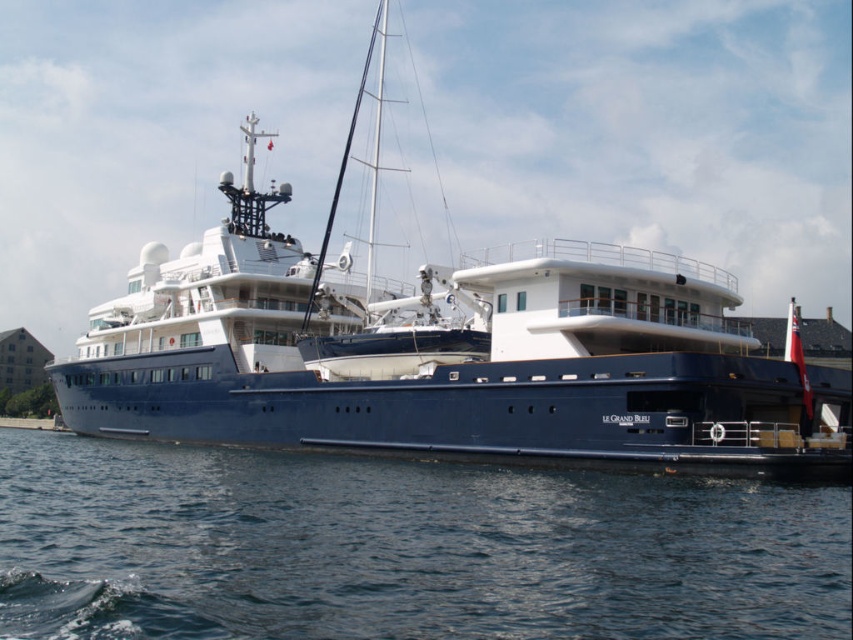
You are a marine engineer assessing the docking space for the blue polished yacht at center. The marina has a docking bay that is 60 meters long. Can the yacht fit into the bay? Please explain your reasoning.

The blue polished yacht at center is 61.26 meters in length, which exceeds the 60 meters available in the docking bay. Therefore, the yacht cannot fit into the bay.

Based on the photo, you are a photographer planning to take a photo of the blue polished yacht at center and the blue water at lower center. Considering their sizes, which object should you focus on to ensure both are clearly visible in the frame?

The blue polished yacht at center is larger than the blue water at lower center, so focusing on the yacht will ensure both are clearly visible in the frame.